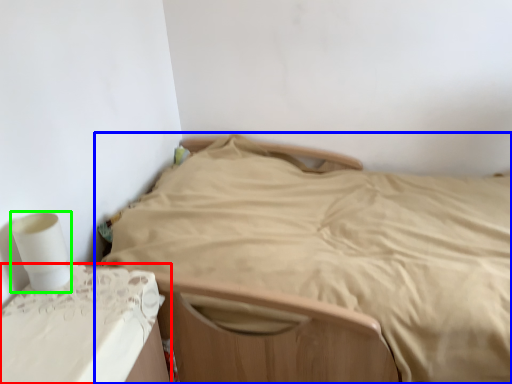
Question: Which object is positioned farthest from furniture (highlighted by a red box)? Select from bed (highlighted by a blue box) and toilet paper (highlighted by a green box).

Choices:
 (A) bed
 (B) toilet paper

Answer: (A)